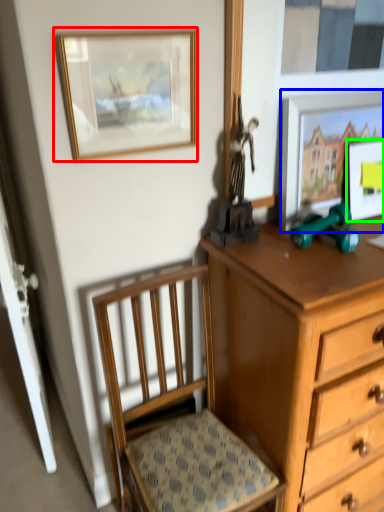
Question: Based on their relative distances, which object is nearer to picture frame (highlighted by a red box)? Choose from picture frame (highlighted by a blue box) and picture frame (highlighted by a green box).

Choices:
 (A) picture frame
 (B) picture frame

Answer: (A)